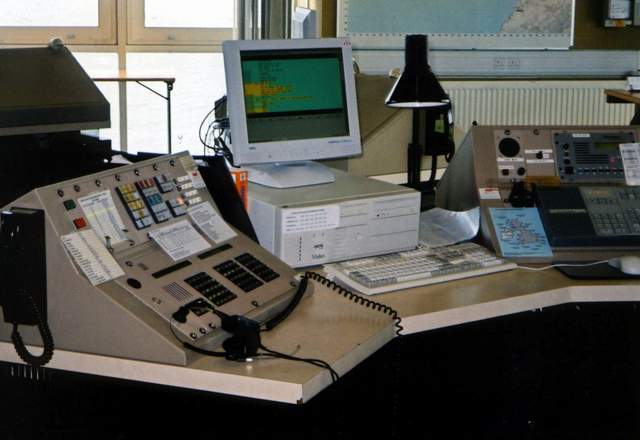
At what (x,y) coordinates should I click in order to perform the action: click on telephone. Please return your answer as a coordinate pair (x, y). Looking at the image, I should click on (34, 272).